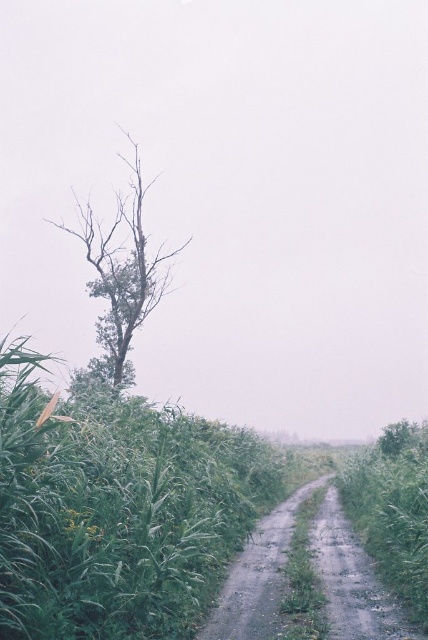
Does point (232, 468) come closer to viewer compared to point (98, 324)?

Yes, it is.

Is green leafy corn field at left smaller than green leafy tree at center?

Yes, green leafy corn field at left is smaller than green leafy tree at center.

Identify the location of green leafy corn field at left. (116, 509).

Who is more forward, (127, 259) or (247, 541)?

Point (247, 541) is in front.

Where is `green leafy tree at center`? Image resolution: width=428 pixels, height=640 pixels. green leafy tree at center is located at coordinates (121, 275).

Describe the element at coordinates (121, 275) in the screenshot. I see `green leafy tree at center` at that location.

Locate an element on the screen. green leafy tree at center is located at coordinates point(121,275).

Does green leafy corn field at left appear under dull gray gravel path at center?

No, green leafy corn field at left is not below dull gray gravel path at center.

Can you confirm if green leafy corn field at left is taller than dull gray gravel path at center?

Yes, green leafy corn field at left is taller than dull gray gravel path at center.

Who is more forward, (32, 461) or (246, 598)?

Point (32, 461) is in front.

Locate an element on the screen. The height and width of the screenshot is (640, 428). green leafy corn field at left is located at coordinates (116, 509).